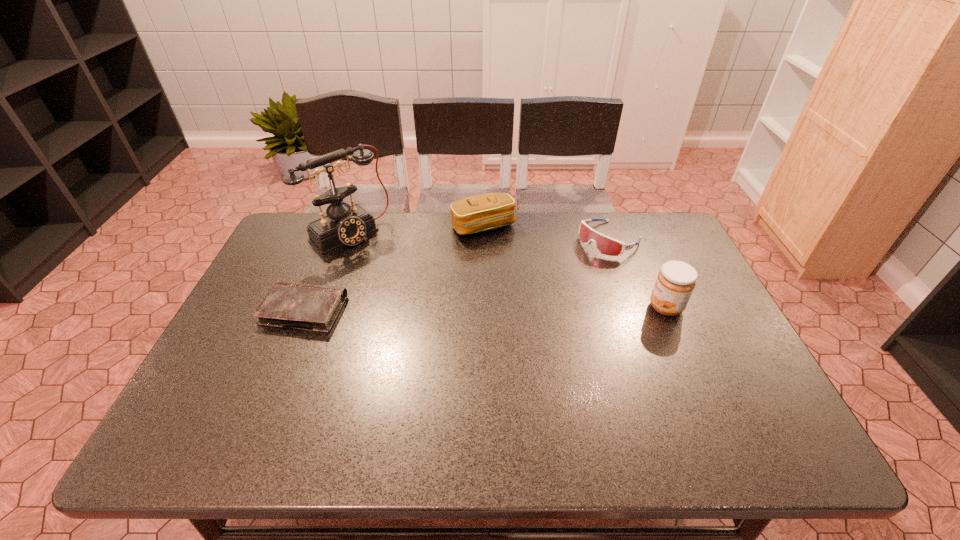
What are the coordinates of `free space on the desktop that is between the shortest object and the jam and is positioned on the front-facing side of the fourth tallest object` in the screenshot? It's located at (506, 309).

Locate an element on the screen. The height and width of the screenshot is (540, 960). vacant space on the desktop that is between the diary and the second tallest object and is positioned on the dial of the telephone is located at coordinates (434, 309).

This screenshot has width=960, height=540. I want to click on free space on the desktop that is between the shortest object and the fourth shortest object and is positioned on the zipper side of the third object from right to left, so click(529, 308).